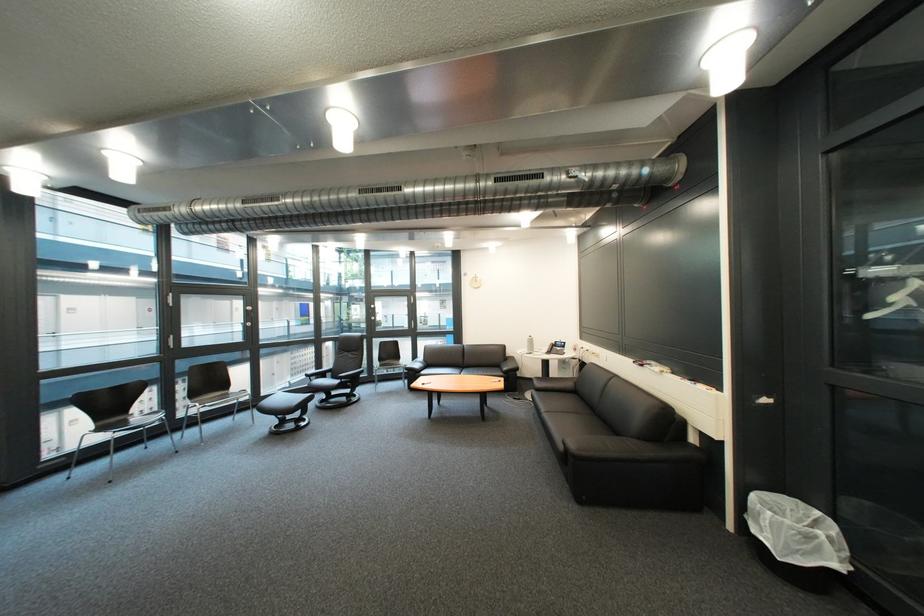
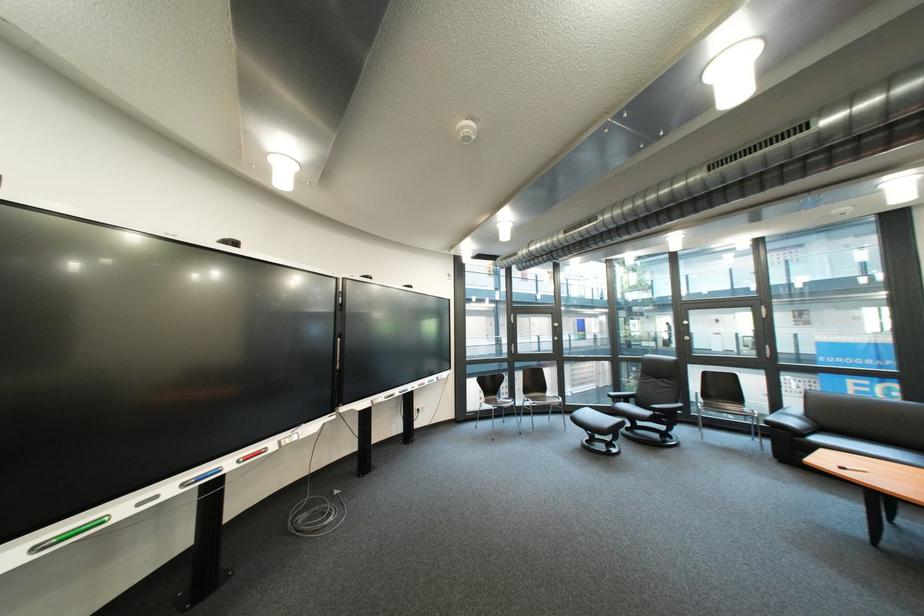
Find the pixel in the second image that matches the point at 217,408 in the first image.

(548, 405)